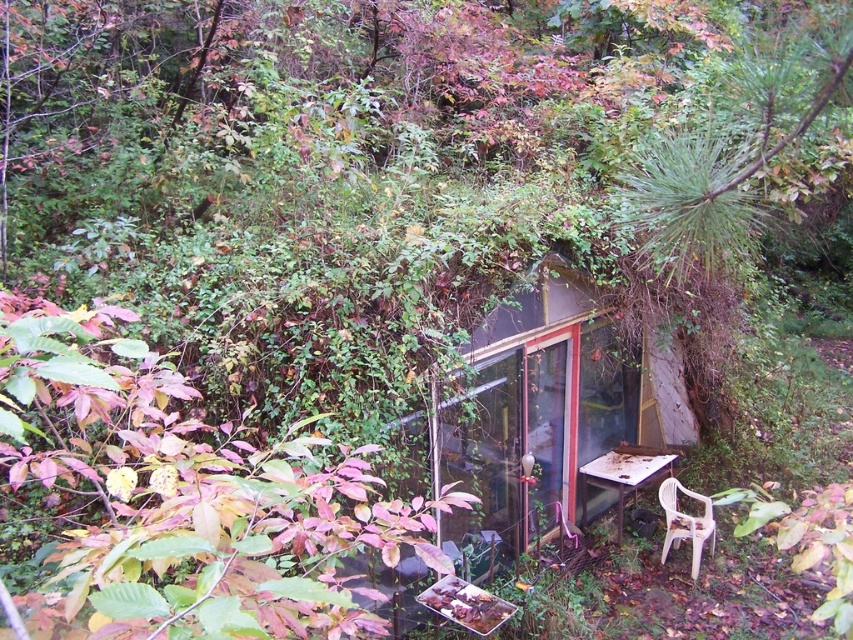
Is point (602, 474) less distant than point (675, 547)?

No, (602, 474) is further to viewer.

Is rusty metal table at lower right bigger than white plastic chair at lower right?

Yes, rusty metal table at lower right is bigger than white plastic chair at lower right.

Which is behind, point (581, 468) or point (676, 540)?

Positioned behind is point (581, 468).

Locate an element on the screen. The width and height of the screenshot is (853, 640). rusty metal table at lower right is located at coordinates (624, 474).

Can you confirm if transparent glass hut at center is positioned to the left of white plastic chair at lower right?

Yes, transparent glass hut at center is to the left of white plastic chair at lower right.

Can you confirm if transparent glass hut at center is thinner than white plastic chair at lower right?

No.

Identify the location of transparent glass hut at center. The width and height of the screenshot is (853, 640). (543, 413).

In order to click on transparent glass hut at center in this screenshot , I will do `click(543, 413)`.

Can you confirm if transparent glass hut at center is positioned below rusty metal table at lower right?

No, transparent glass hut at center is not below rusty metal table at lower right.

Where is `transparent glass hut at center`? transparent glass hut at center is located at coordinates (543, 413).

Is point (556, 442) farther from viewer compared to point (622, 474)?

Yes, it is behind point (622, 474).

Locate an element on the screen. This screenshot has height=640, width=853. transparent glass hut at center is located at coordinates (543, 413).